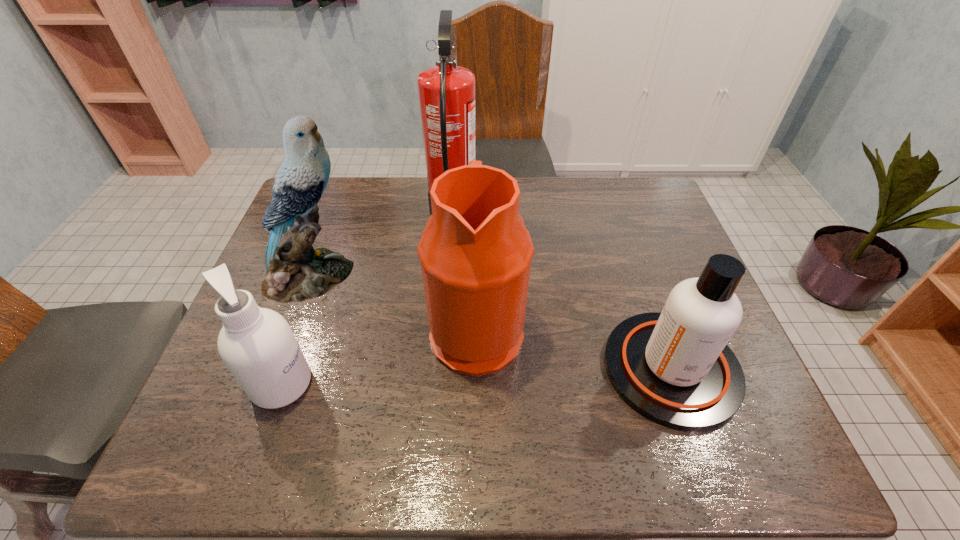
Where is `vacant region at the near left corner`? This screenshot has height=540, width=960. vacant region at the near left corner is located at coordinates (214, 470).

I want to click on free space between the farthest object and the left cleansing agent, so click(x=368, y=300).

At what (x,y) coordinates should I click in order to perform the action: click on free point between the left cleansing agent and the water jug. Please return your answer as a coordinate pair (x, y). Looking at the image, I should click on (379, 357).

This screenshot has height=540, width=960. I want to click on unoccupied position between the water jug and the parakeet, so click(x=395, y=303).

Locate an element on the screen. unoccupied position between the parakeet and the water jug is located at coordinates (395, 303).

You are a GUI agent. You are given a task and a screenshot of the screen. Output one action in this format:
    pyautogui.click(x=<x>, y=<y>)
    Task: Click on the free space between the farthest object and the rightmost object
    This screenshot has width=960, height=540.
    Given the screenshot: What is the action you would take?
    pyautogui.click(x=562, y=293)

Find the location of a particular element. free space between the tallest object and the parakeet is located at coordinates (382, 246).

Image resolution: width=960 pixels, height=540 pixels. Identify the location of unoccupied position between the left cleansing agent and the parakeet. (297, 330).

Find the location of a particular element. The height and width of the screenshot is (540, 960). unoccupied position between the farthest object and the rightmost object is located at coordinates (562, 293).

The height and width of the screenshot is (540, 960). Identify the location of free space between the parakeet and the left cleansing agent. (297, 330).